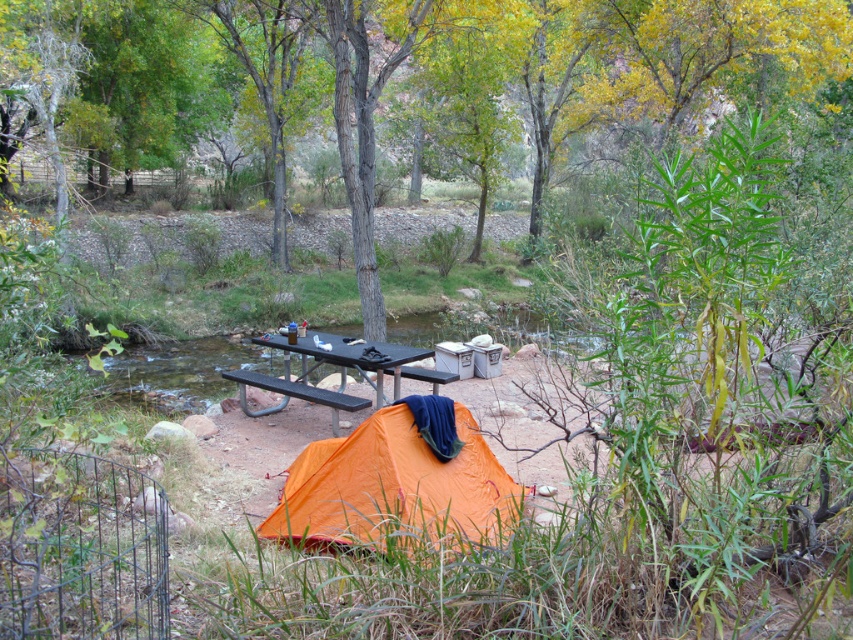
You are a photographer standing at the camera position. You want to take a photo of the orange nylon tent at lower center. Can you fit the entire tent into your camera frame without moving? The camera has a field of view of 8 feet.

The orange nylon tent at lower center and camera are 9.51 feet apart from each other. Since the distance between them is greater than the camera field of view of 8 feet, the entire tent cannot be captured in the frame without moving the camera.

You are standing at the point marked by the coordinates point (421, 77). What do you see directly in front of you?

The point (421, 77) indicates a green leafy tree at center, so you would see the green leafy tree at center directly in front of you.